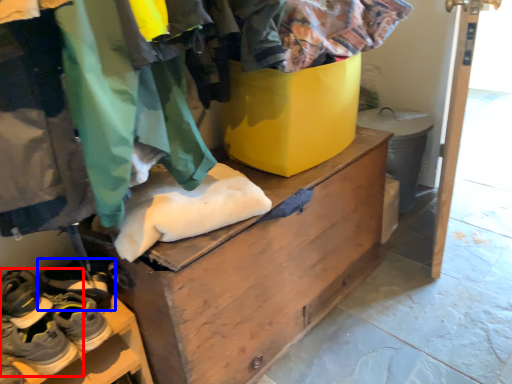
Question: Among these objects, which one is nearest to the camera, footwear (highlighted by a red box) or footwear (highlighted by a blue box)?

Choices:
 (A) footwear
 (B) footwear

Answer: (A)